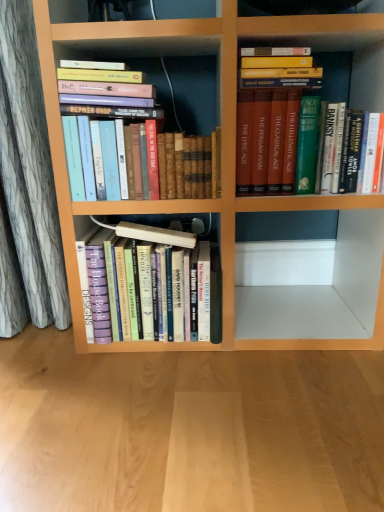
Find the location of `empty space that is ontop of wooden floor at lower center (from a real-world perspective)`. empty space that is ontop of wooden floor at lower center (from a real-world perspective) is located at coordinates (183, 385).